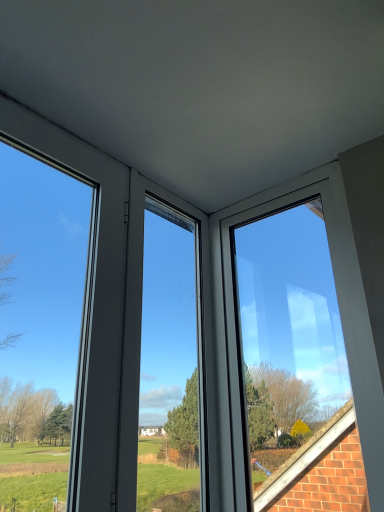
What do you see at coordinates (95, 290) in the screenshot? Image resolution: width=384 pixels, height=512 pixels. I see `transparent glass window at left, the first window positioned from the left` at bounding box center [95, 290].

In order to face transparent glass window at left, marked as the second window in a right-to-left arrangement, should I rotate leftwards or rightwards?

It's best to rotate left around 19.691 degrees.

Locate an element on the screen. transparent glass window at left, the first window positioned from the left is located at coordinates (95, 290).

The width and height of the screenshot is (384, 512). I want to click on transparent glass window at upper right, the 2th window when ordered from left to right, so click(288, 311).

What do you see at coordinates (288, 311) in the screenshot? Image resolution: width=384 pixels, height=512 pixels. I see `transparent glass window at upper right, marked as the 1th window in a right-to-left arrangement` at bounding box center [288, 311].

The image size is (384, 512). I want to click on transparent glass window at left, marked as the second window in a right-to-left arrangement, so pyautogui.click(x=95, y=290).

Does transparent glass window at upper right, the 2th window when ordered from left to right, appear on the right side of transparent glass window at left, the first window positioned from the left?

Yes.

Is transparent glass window at upper right, the 2th window when ordered from left to right, further to the viewer compared to transparent glass window at left, the first window positioned from the left?

Yes, the depth of transparent glass window at upper right, the 2th window when ordered from left to right, is greater than that of transparent glass window at left, the first window positioned from the left.

Between point (300, 304) and point (100, 322), which one is positioned in front?

Positioned in front is point (100, 322).

From the image's perspective, which is above, transparent glass window at upper right, the 2th window when ordered from left to right, or transparent glass window at left, the first window positioned from the left?

transparent glass window at left, the first window positioned from the left, from the image's perspective.

From a real-world perspective, is transparent glass window at upper right, the 2th window when ordered from left to right, positioned above or below transparent glass window at left, marked as the second window in a right-to-left arrangement?

From a real-world perspective, transparent glass window at upper right, the 2th window when ordered from left to right, is physically below transparent glass window at left, marked as the second window in a right-to-left arrangement.

Between transparent glass window at upper right, the 2th window when ordered from left to right, and transparent glass window at left, the first window positioned from the left, which one has smaller width?

transparent glass window at left, the first window positioned from the left, is thinner.

Considering the relative sizes of transparent glass window at upper right, marked as the 1th window in a right-to-left arrangement, and transparent glass window at left, marked as the second window in a right-to-left arrangement, in the image provided, is transparent glass window at upper right, marked as the 1th window in a right-to-left arrangement, shorter than transparent glass window at left, marked as the second window in a right-to-left arrangement,?

In fact, transparent glass window at upper right, marked as the 1th window in a right-to-left arrangement, may be taller than transparent glass window at left, marked as the second window in a right-to-left arrangement.

Considering the relative sizes of transparent glass window at upper right, the 2th window when ordered from left to right, and transparent glass window at left, marked as the second window in a right-to-left arrangement, in the image provided, is transparent glass window at upper right, the 2th window when ordered from left to right, bigger than transparent glass window at left, marked as the second window in a right-to-left arrangement,?

Yes, transparent glass window at upper right, the 2th window when ordered from left to right, is bigger than transparent glass window at left, marked as the second window in a right-to-left arrangement.

Choose the correct answer: Is transparent glass window at upper right, the 2th window when ordered from left to right, inside transparent glass window at left, the first window positioned from the left, or outside it?

transparent glass window at upper right, the 2th window when ordered from left to right, lies outside transparent glass window at left, the first window positioned from the left.

Can you see transparent glass window at upper right, the 2th window when ordered from left to right, touching transparent glass window at left, the first window positioned from the left?

No, transparent glass window at upper right, the 2th window when ordered from left to right, is not making contact with transparent glass window at left, the first window positioned from the left.

Is transparent glass window at upper right, the 2th window when ordered from left to right, aimed at transparent glass window at left, the first window positioned from the left?

Yes, transparent glass window at upper right, the 2th window when ordered from left to right, is facing transparent glass window at left, the first window positioned from the left.

Can you tell me how much transparent glass window at upper right, marked as the 1th window in a right-to-left arrangement, and transparent glass window at left, the first window positioned from the left, differ in facing direction?

They differ by 90.1 degrees in their facing directions.

At what (x,y) coordinates should I click in order to perform the action: click on window behind the transparent glass window at left, the first window positioned from the left. Please return your answer as a coordinate pair (x, y). Image resolution: width=384 pixels, height=512 pixels. Looking at the image, I should click on (288, 311).

Can you confirm if transparent glass window at left, the first window positioned from the left, is positioned to the left of transparent glass window at upper right, the 2th window when ordered from left to right?

Yes, transparent glass window at left, the first window positioned from the left, is to the left of transparent glass window at upper right, the 2th window when ordered from left to right.

Which object is closer to the camera, transparent glass window at left, the first window positioned from the left, or transparent glass window at upper right, marked as the 1th window in a right-to-left arrangement?

transparent glass window at left, the first window positioned from the left, is more forward.

Does point (59, 150) appear closer or farther from the camera than point (340, 420)?

Clearly, point (59, 150) is closer to the camera than point (340, 420).

In the scene shown: From the image's perspective, is transparent glass window at left, marked as the second window in a right-to-left arrangement, positioned above or below transparent glass window at upper right, marked as the 1th window in a right-to-left arrangement?

Based on their image positions, transparent glass window at left, marked as the second window in a right-to-left arrangement, is located above transparent glass window at upper right, marked as the 1th window in a right-to-left arrangement.

From a real-world perspective, is transparent glass window at left, marked as the second window in a right-to-left arrangement, physically located above or below transparent glass window at upper right, marked as the 1th window in a right-to-left arrangement?

transparent glass window at left, marked as the second window in a right-to-left arrangement, is situated higher than transparent glass window at upper right, marked as the 1th window in a right-to-left arrangement, in the real world.

Between transparent glass window at left, the first window positioned from the left, and transparent glass window at upper right, the 2th window when ordered from left to right, which one has smaller width?

transparent glass window at left, the first window positioned from the left, is thinner.

Considering the sizes of objects transparent glass window at left, marked as the second window in a right-to-left arrangement, and transparent glass window at upper right, the 2th window when ordered from left to right, in the image provided, who is shorter, transparent glass window at left, marked as the second window in a right-to-left arrangement, or transparent glass window at upper right, the 2th window when ordered from left to right,?

transparent glass window at left, marked as the second window in a right-to-left arrangement.

Considering the sizes of transparent glass window at left, the first window positioned from the left, and transparent glass window at upper right, the 2th window when ordered from left to right, in the image, is transparent glass window at left, the first window positioned from the left, bigger or smaller than transparent glass window at upper right, the 2th window when ordered from left to right,?

transparent glass window at left, the first window positioned from the left, is smaller than transparent glass window at upper right, the 2th window when ordered from left to right.

Would you say transparent glass window at left, the first window positioned from the left, is inside or outside transparent glass window at upper right, marked as the 1th window in a right-to-left arrangement?

transparent glass window at left, the first window positioned from the left, cannot be found inside transparent glass window at upper right, marked as the 1th window in a right-to-left arrangement.

Would you consider transparent glass window at left, the first window positioned from the left, to be distant from transparent glass window at upper right, the 2th window when ordered from left to right?

No, transparent glass window at left, the first window positioned from the left, is not far from transparent glass window at upper right, the 2th window when ordered from left to right.

Is transparent glass window at left, marked as the second window in a right-to-left arrangement, looking in the opposite direction of transparent glass window at upper right, marked as the 1th window in a right-to-left arrangement?

No, transparent glass window at upper right, marked as the 1th window in a right-to-left arrangement, is not at the back of transparent glass window at left, marked as the second window in a right-to-left arrangement.

How many degrees apart are the facing directions of transparent glass window at left, the first window positioned from the left, and transparent glass window at upper right, marked as the 1th window in a right-to-left arrangement?

There is a 90.1-degree angle between the facing directions of transparent glass window at left, the first window positioned from the left, and transparent glass window at upper right, marked as the 1th window in a right-to-left arrangement.

Could you measure the distance between transparent glass window at left, the first window positioned from the left, and transparent glass window at upper right, the 2th window when ordered from left to right?

transparent glass window at left, the first window positioned from the left, is 27.68 inches from transparent glass window at upper right, the 2th window when ordered from left to right.

Identify the location of window on the right of transparent glass window at left, marked as the second window in a right-to-left arrangement. The image size is (384, 512). (288, 311).

Where is `window below the transparent glass window at left, marked as the second window in a right-to-left arrangement (from the image's perspective)`? This screenshot has width=384, height=512. window below the transparent glass window at left, marked as the second window in a right-to-left arrangement (from the image's perspective) is located at coordinates (288, 311).

Find the location of a particular element. window on the right of transparent glass window at left, the first window positioned from the left is located at coordinates (288, 311).